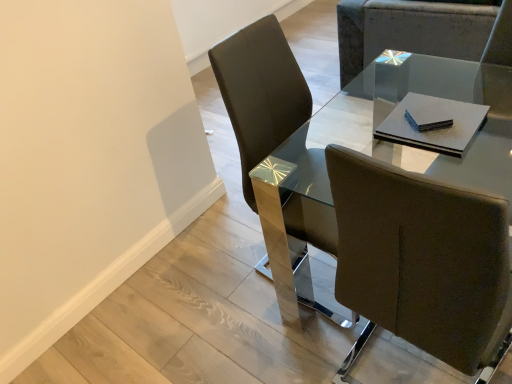
Question: Can you confirm if brown leather chair at center, which is the 2th chair from right to left, is smaller than matte brown chair at upper right, which is counted as the 2th chair, starting from the bottom?

Choices:
 (A) yes
 (B) no

Answer: (A)

Question: Is brown leather chair at center, the first chair when ordered from bottom to top, located outside matte brown chair at upper right, which is the 2th chair from front to back?

Choices:
 (A) yes
 (B) no

Answer: (A)

Question: Can you confirm if brown leather chair at center, which is the 2th chair from right to left, is bigger than matte brown chair at upper right, which is the 1th chair from top to bottom?

Choices:
 (A) yes
 (B) no

Answer: (B)

Question: Considering the relative sizes of brown leather chair at center, the first chair when ordered from left to right, and matte brown chair at upper right, which is the 1th chair from top to bottom, in the image provided, is brown leather chair at center, the first chair when ordered from left to right, wider than matte brown chair at upper right, which is the 1th chair from top to bottom,?

Choices:
 (A) yes
 (B) no

Answer: (B)

Question: Is brown leather chair at center, which ranks as the 2th chair in top-to-bottom order, far from matte brown chair at upper right, which is counted as the 2th chair, starting from the bottom?

Choices:
 (A) yes
 (B) no

Answer: (A)

Question: Based on their sizes in the image, would you say glass/metal table at center is bigger or smaller than matte brown chair at upper right, which is counted as the 1th chair, starting from the back?

Choices:
 (A) small
 (B) big

Answer: (A)

Question: From the image's perspective, is glass/metal table at center located above or below matte brown chair at upper right, which is counted as the 1th chair, starting from the back?

Choices:
 (A) below
 (B) above

Answer: (A)

Question: Is glass/metal table at center in front of or behind matte brown chair at upper right, which is the 2th chair from front to back, in the image?

Choices:
 (A) behind
 (B) front

Answer: (B)

Question: From a real-world perspective, is glass/metal table at center above or below matte brown chair at upper right, which is counted as the 2th chair, starting from the bottom?

Choices:
 (A) below
 (B) above

Answer: (B)

Question: From their relative heights in the image, would you say matte brown chair at upper right, which ranks as the second chair in left-to-right order, is taller or shorter than brown leather chair at center, which is the 2th chair from right to left?

Choices:
 (A) tall
 (B) short

Answer: (B)

Question: Considering the positions of matte brown chair at upper right, the 1th chair positioned from the right, and brown leather chair at center, the second chair when ordered from back to front, in the image, is matte brown chair at upper right, the 1th chair positioned from the right, wider or thinner than brown leather chair at center, the second chair when ordered from back to front,?

Choices:
 (A) wide
 (B) thin

Answer: (A)

Question: Considering the positions of point (343, 82) and point (262, 76), is point (343, 82) closer or farther from the camera than point (262, 76)?

Choices:
 (A) farther
 (B) closer

Answer: (A)

Question: Based on their positions, is matte brown chair at upper right, the 1th chair positioned from the right, located to the left or right of brown leather chair at center, which ranks as the 2th chair in top-to-bottom order?

Choices:
 (A) left
 (B) right

Answer: (B)

Question: Considering the positions of point (247, 39) and point (369, 29), is point (247, 39) closer or farther from the camera than point (369, 29)?

Choices:
 (A) closer
 (B) farther

Answer: (A)

Question: Looking at their shapes, would you say brown leather chair at center, the first chair when ordered from left to right, is wider or thinner than matte brown chair at upper right, which is counted as the 2th chair, starting from the bottom?

Choices:
 (A) thin
 (B) wide

Answer: (A)